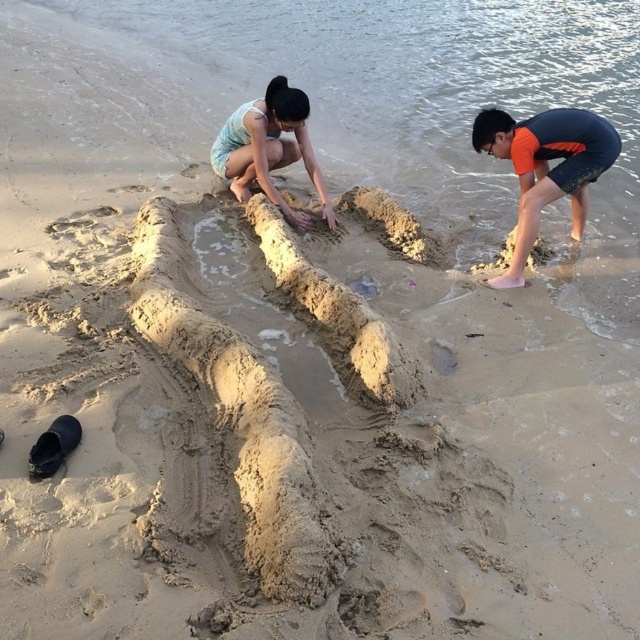
Question: Does orange fabric at right appear on the left side of light blue fabric at center?

Choices:
 (A) no
 (B) yes

Answer: (A)

Question: Which of the following is the closest to the observer?

Choices:
 (A) (545, 118)
 (B) (264, 96)

Answer: (A)

Question: Is orange fabric at right smaller than light blue fabric at center?

Choices:
 (A) no
 (B) yes

Answer: (A)

Question: Which of the following is the farthest from the observer?

Choices:
 (A) orange fabric at right
 (B) light blue fabric at center

Answer: (B)

Question: From the image, what is the correct spatial relationship of orange fabric at right in relation to light blue fabric at center?

Choices:
 (A) below
 (B) above

Answer: (A)

Question: Among these objects, which one is nearest to the camera?

Choices:
 (A) light blue fabric at center
 (B) orange fabric at right

Answer: (B)